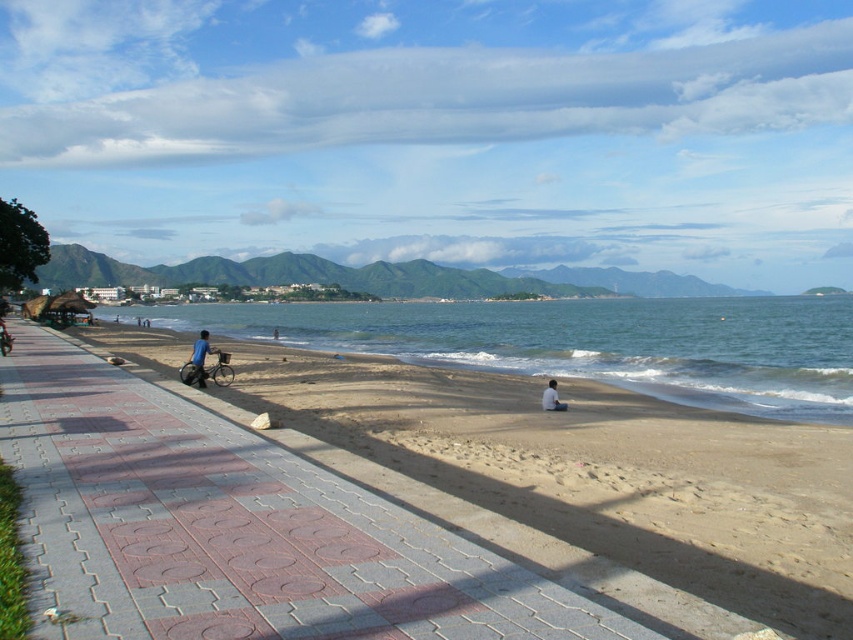
You are standing at the center of the walkway and want to reach the sandy beach at lower left. According to the coordinates provided, in which direction should you walk to get there?

The sandy beach at lower left is located at coordinates point (587, 474). Since you are at the center of the walkway, you should walk towards the lower left direction to reach it.

You are standing at the point marked by coordinates point (587, 474) in the image. What is the closest land feature to you?

The point (587, 474) indicates sandy beach at lower left, so the closest land feature to you is the sandy beach at lower left.

You are standing at the camera position and want to reach the two points marked in the image. Which point, point (x=369, y=380) or point (x=740, y=337), will you reach first as you move forward?

You will reach point (x=369, y=380) first because it is closer to the camera than point (x=740, y=337).